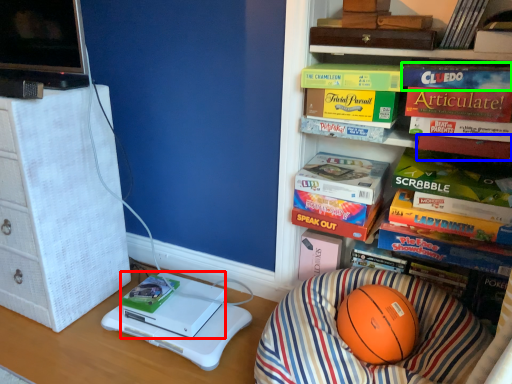
Question: Which object is positioned farthest from box (highlighted by a red box)? Select from paperback book (highlighted by a blue box) and paperback book (highlighted by a green box).

Choices:
 (A) paperback book
 (B) paperback book

Answer: (B)